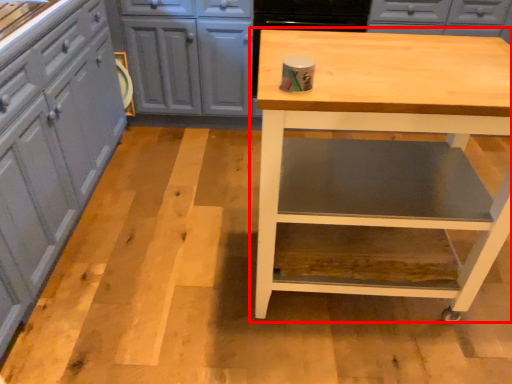
Question: Observing the image, what is the correct spatial positioning of table (annotated by the red box) in reference to cabinetry?

Choices:
 (A) left
 (B) right

Answer: (B)